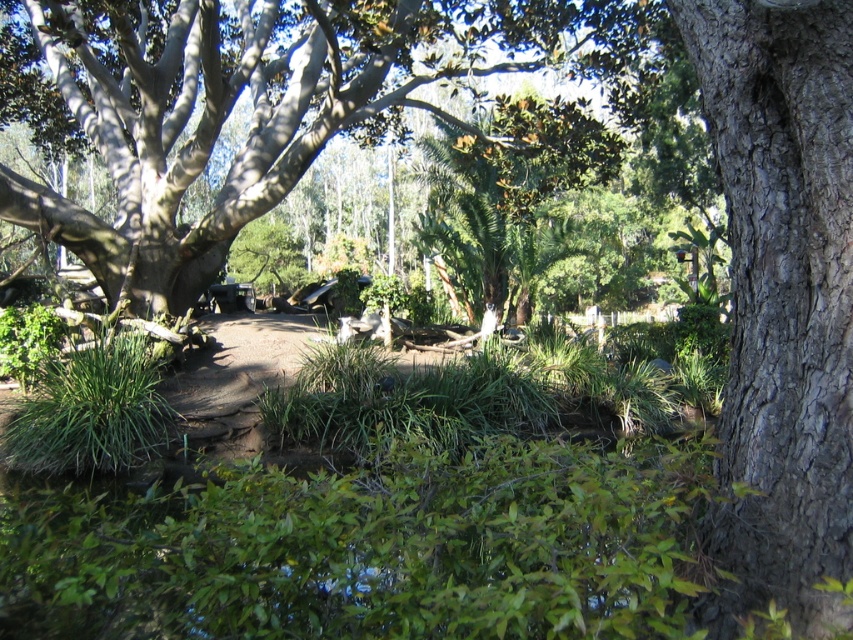
Who is shorter, smooth gray bark tree at upper left or gray textured bark tree at right?

gray textured bark tree at right

The height and width of the screenshot is (640, 853). What do you see at coordinates (254, 106) in the screenshot? I see `smooth gray bark tree at upper left` at bounding box center [254, 106].

Locate an element on the screen. smooth gray bark tree at upper left is located at coordinates (254, 106).